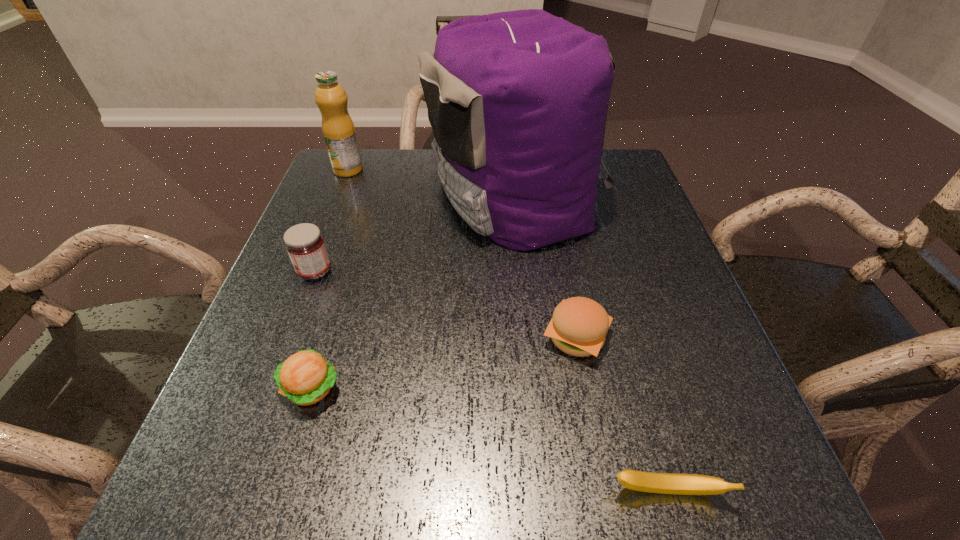
Image resolution: width=960 pixels, height=540 pixels. Find the location of `backpack`. backpack is located at coordinates (517, 101).

At what (x,y) coordinates should I click in order to perform the action: click on fruit juice. Please return your answer as a coordinate pair (x, y). Looking at the image, I should click on (338, 129).

Find the location of a particular element. jam is located at coordinates (305, 245).

Locate an element on the screen. The width and height of the screenshot is (960, 540). the fourth shortest object is located at coordinates (305, 245).

Find the location of `the right hamburger`. the right hamburger is located at coordinates (579, 325).

At what (x,y) coordinates should I click in order to perform the action: click on the left hamburger. Please return your answer as a coordinate pair (x, y). This screenshot has height=540, width=960. Looking at the image, I should click on (305, 378).

The image size is (960, 540). I want to click on the nearest object, so click(664, 483).

The image size is (960, 540). I want to click on banana, so click(x=664, y=483).

At what (x,y) coordinates should I click in order to perform the action: click on vacant space situated 0.220m on the front pocket of the backpack. Please return your answer as a coordinate pair (x, y). Looking at the image, I should click on 341,197.

Image resolution: width=960 pixels, height=540 pixels. In order to click on blank area located on the front pocket of the backpack in this screenshot , I will do `click(332, 197)`.